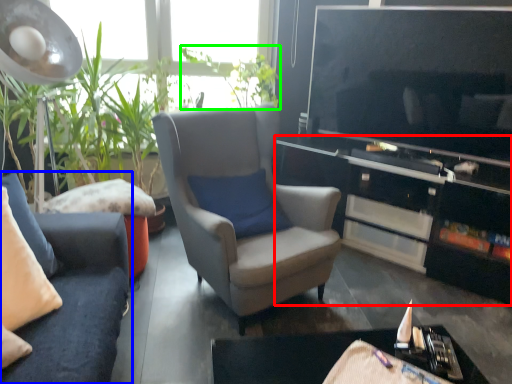
Question: Which object is positioned farthest from cabinetry (highlighted by a red box)? Select from studio couch (highlighted by a blue box) and plant (highlighted by a green box).

Choices:
 (A) studio couch
 (B) plant

Answer: (A)